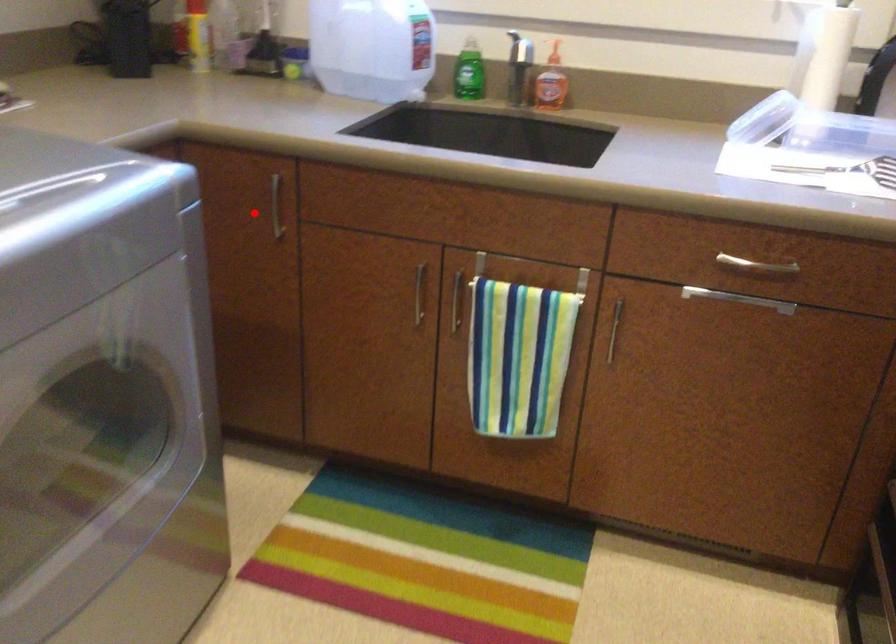
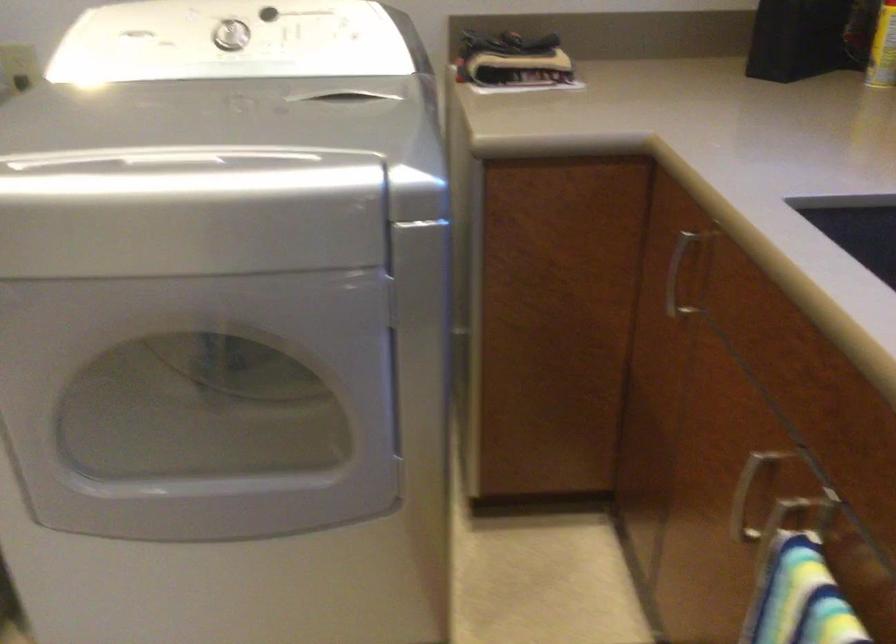
Where in the second image is the point corresponding to the highlighted location from the first image?

(677, 275)